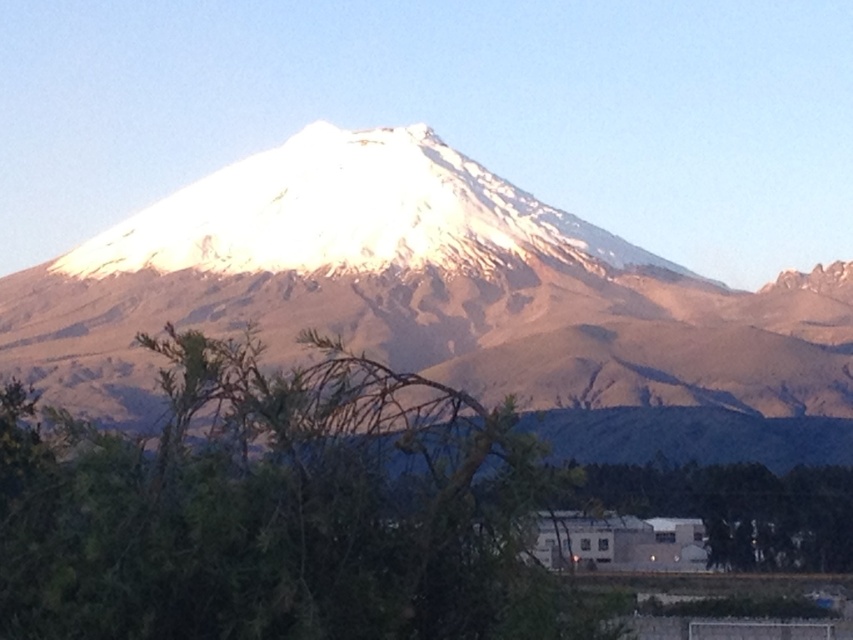
Question: Is white snow-covered mountain at center thinner than green leafy tree at lower left?

Choices:
 (A) yes
 (B) no

Answer: (B)

Question: Is white snow-covered mountain at center smaller than green leafy tree at lower left?

Choices:
 (A) yes
 (B) no

Answer: (B)

Question: Which point appears closest to the camera in this image?

Choices:
 (A) (199, 500)
 (B) (675, 426)

Answer: (A)

Question: Can you confirm if white snow-covered mountain at center is smaller than green leafy tree at lower left?

Choices:
 (A) yes
 (B) no

Answer: (B)